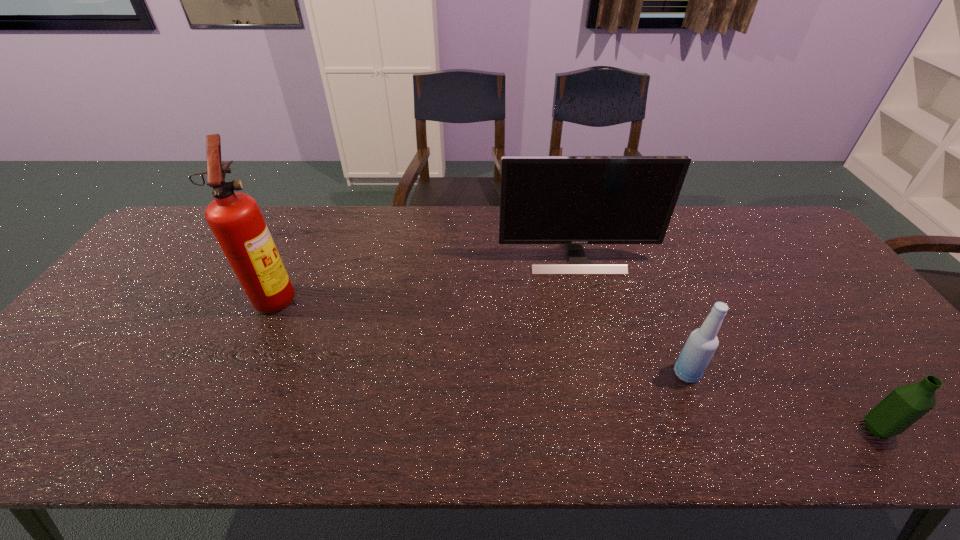
Locate an element on the screen. the leftmost object is located at coordinates (235, 219).

The height and width of the screenshot is (540, 960). I want to click on fire extinguisher, so click(x=235, y=219).

Identify the location of the second tallest object. This screenshot has width=960, height=540. (573, 200).

You are a GUI agent. You are given a task and a screenshot of the screen. Output one action in this format:
    pyautogui.click(x=<x>, y=<y>)
    Task: Click on the farthest object
    
    Given the screenshot: What is the action you would take?
    pyautogui.click(x=573, y=200)

Locate an element on the screen. bottle is located at coordinates (702, 343).

You are a GUI agent. You are given a task and a screenshot of the screen. Output one action in this format:
    pyautogui.click(x=<x>, y=<y>)
    Task: Click on the third farthest object
    The width and height of the screenshot is (960, 540).
    Given the screenshot: What is the action you would take?
    pyautogui.click(x=702, y=343)

I want to click on the rightmost object, so click(905, 405).

Where is `the nearest object`? The width and height of the screenshot is (960, 540). the nearest object is located at coordinates (905, 405).

Identify the location of free point located on the front-facing side of the second farthest object. (379, 296).

Where is `vacant area located 0.400m on the screen side of the farthest object`? Image resolution: width=960 pixels, height=540 pixels. vacant area located 0.400m on the screen side of the farthest object is located at coordinates (609, 393).